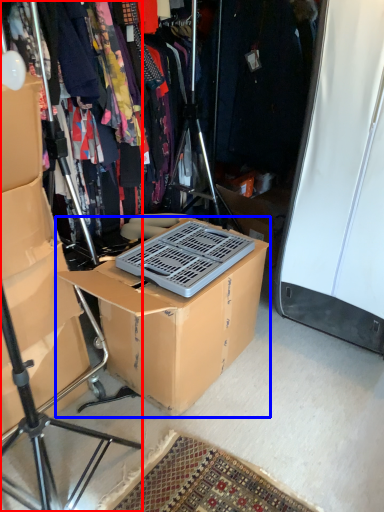
Question: Which point is closer to the camera, tripod (highlighted by a red box) or box (highlighted by a blue box)?

Choices:
 (A) tripod
 (B) box

Answer: (A)